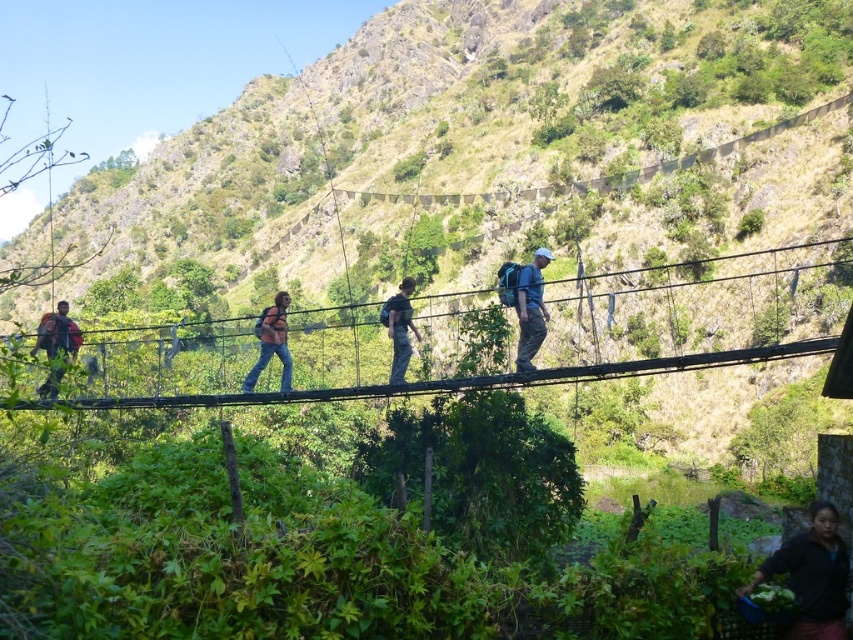
Question: Can you confirm if dark blue fabric at lower right is thinner than dark blue jeans at center?

Choices:
 (A) no
 (B) yes

Answer: (A)

Question: Which point is closer to the camera taking this photo?

Choices:
 (A) (526, 371)
 (B) (776, 563)
 (C) (265, 314)
 (D) (47, 376)

Answer: (B)

Question: Among these objects, which one is farthest from the camera?

Choices:
 (A) blue fabric backpack at center
 (B) green grassy hillside at center
 (C) dark blue jeans at center

Answer: (B)

Question: Which of the following is the closest to the observer?

Choices:
 (A) (405, 362)
 (B) (54, 374)

Answer: (B)

Question: Is orange fabric backpack at center to the left of dark brown backpack at left from the viewer's perspective?

Choices:
 (A) yes
 (B) no

Answer: (B)

Question: Is green grassy hillside at center wider than dark brown backpack at left?

Choices:
 (A) no
 (B) yes

Answer: (B)